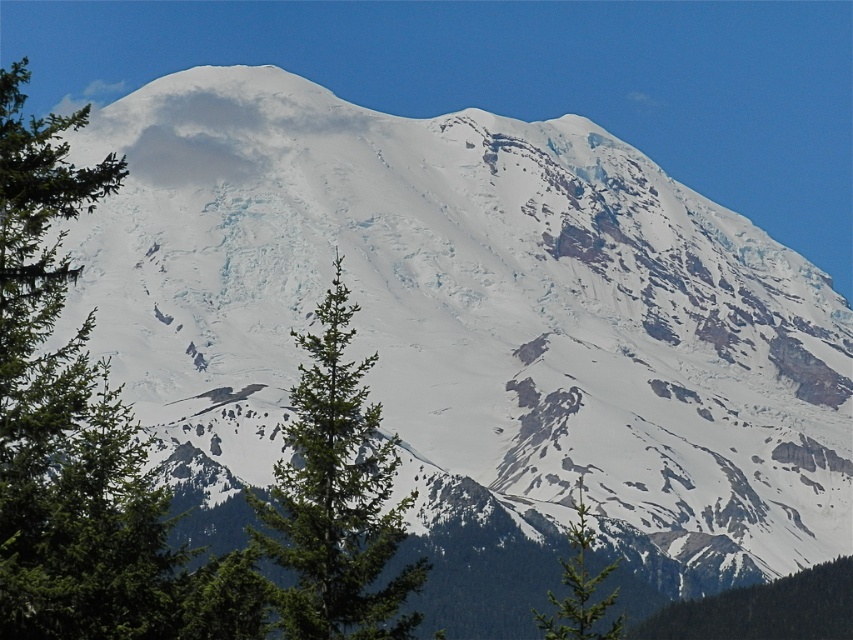
You are planning to set up a tent for a winter camping trip. You have two options for locations near the green textured pine tree at left and the green matte tree at lower right. Which location would provide better wind protection based on their heights?

The green textured pine tree at left is taller than the green matte tree at lower right, so setting up the tent near the green textured pine tree at left would provide better wind protection due to its greater height.